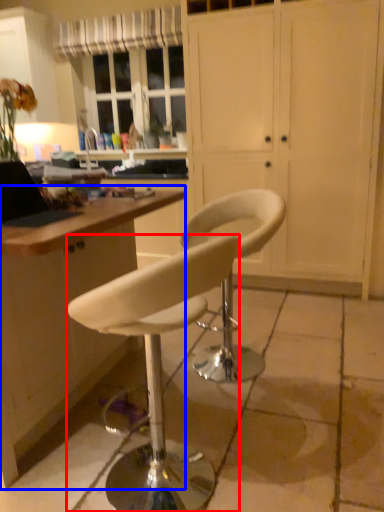
Question: Which of the following is the farthest to the observer, chair (highlighted by a red box) or desk (highlighted by a blue box)?

Choices:
 (A) chair
 (B) desk

Answer: (B)